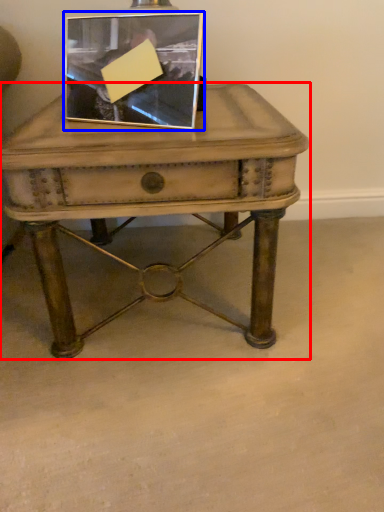
Question: Among these objects, which one is nearest to the camera, table (highlighted by a red box) or picture frame (highlighted by a blue box)?

Choices:
 (A) table
 (B) picture frame

Answer: (A)